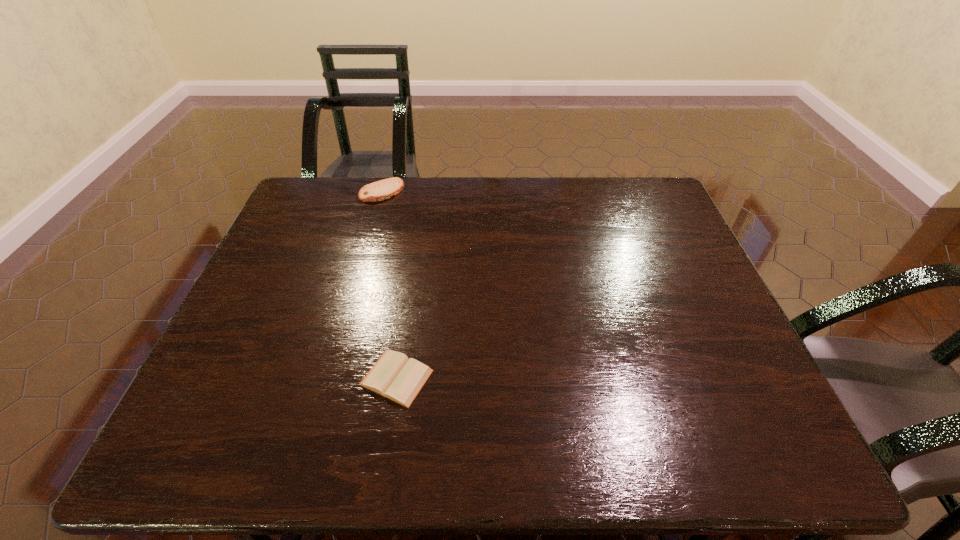
The height and width of the screenshot is (540, 960). Find the location of `pita bread`. pita bread is located at coordinates (384, 189).

Locate an element on the screen. the taller object is located at coordinates (384, 189).

Where is `the nearer object`? The height and width of the screenshot is (540, 960). the nearer object is located at coordinates (395, 376).

Identify the location of the shorter object. (395, 376).

Image resolution: width=960 pixels, height=540 pixels. In order to click on free space located on the right of the farther object in this screenshot , I will do `click(419, 192)`.

Where is `vacant space located 0.260m on the right of the shorter object`? Image resolution: width=960 pixels, height=540 pixels. vacant space located 0.260m on the right of the shorter object is located at coordinates (553, 377).

At what (x,y) coordinates should I click in order to perform the action: click on object positioned at the far edge. Please return your answer as a coordinate pair (x, y). Image resolution: width=960 pixels, height=540 pixels. Looking at the image, I should click on (384, 189).

The height and width of the screenshot is (540, 960). I want to click on vacant space at the far edge of the desktop, so click(516, 202).

Where is `free location at the near edge`? This screenshot has height=540, width=960. free location at the near edge is located at coordinates (474, 450).

In the image, there is a desktop. At what (x,y) coordinates should I click in order to perform the action: click on vacant space at the left edge. Please return your answer as a coordinate pair (x, y). The image size is (960, 540). Looking at the image, I should click on (281, 241).